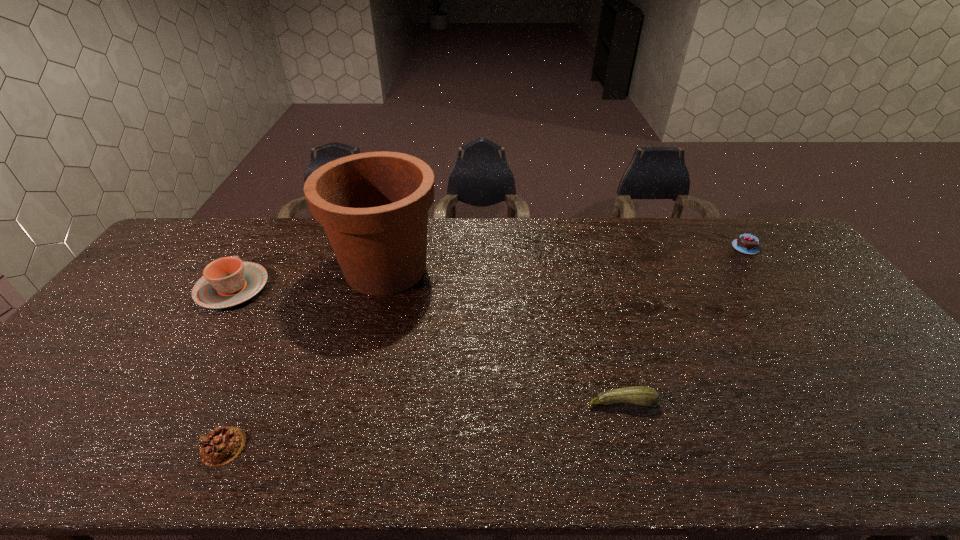
Image resolution: width=960 pixels, height=540 pixels. What are the coordinates of `unoccupied area between the tallest object and the right chocolate cake` in the screenshot? It's located at (565, 258).

Where is `vacant area that lies between the zucchini and the chinaware`? The height and width of the screenshot is (540, 960). vacant area that lies between the zucchini and the chinaware is located at coordinates (427, 345).

Where is `unoccupied position between the leftmost object and the left chocolate cake`? This screenshot has width=960, height=540. unoccupied position between the leftmost object and the left chocolate cake is located at coordinates (228, 367).

This screenshot has width=960, height=540. I want to click on free space between the second nearest object and the right chocolate cake, so click(x=684, y=325).

Select which object appears as the fourth closest to the third object from right to left. Please provide its 2D coordinates. Your answer should be formatted as a tuple, i.e. [(x, y)], where the tuple contains the x and y coordinates of a point satisfying the conditions above.

[(746, 243)]

Find the location of a particular element. object that stands as the third closest to the nearer chocolate cake is located at coordinates (645, 396).

Identify the location of blank space that satisfies the following two spatial constraints: 1. on the handle side of the chinaware; 2. on the right side of the rightmost object. point(258,247).

Find the location of `free location that satisfies the following two spatial constraints: 1. on the handle side of the second tallest object; 2. on the left side of the third object from left to right`. free location that satisfies the following two spatial constraints: 1. on the handle side of the second tallest object; 2. on the left side of the third object from left to right is located at coordinates click(245, 269).